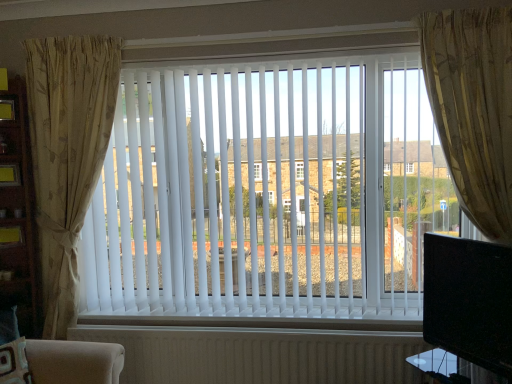
Question: Considering the relative sizes of white ribbed radiator at bottom and beige floral fabric curtain at left, which ranks as the 2th curtain in right-to-left order, in the image provided, is white ribbed radiator at bottom thinner than beige floral fabric curtain at left, which ranks as the 2th curtain in right-to-left order,?

Choices:
 (A) yes
 (B) no

Answer: (A)

Question: Can you confirm if white ribbed radiator at bottom is shorter than beige floral fabric curtain at left, which is the 1th curtain from left to right?

Choices:
 (A) no
 (B) yes

Answer: (B)

Question: From the image's perspective, is white ribbed radiator at bottom on top of beige floral fabric curtain at left, which ranks as the 2th curtain in right-to-left order?

Choices:
 (A) no
 (B) yes

Answer: (A)

Question: Is white ribbed radiator at bottom next to beige floral fabric curtain at left, which ranks as the 2th curtain in right-to-left order?

Choices:
 (A) no
 (B) yes

Answer: (A)

Question: Is the depth of white ribbed radiator at bottom greater than that of beige floral fabric curtain at left, which ranks as the 2th curtain in right-to-left order?

Choices:
 (A) yes
 (B) no

Answer: (A)

Question: Does white ribbed radiator at bottom have a greater width compared to beige floral fabric curtain at left, which ranks as the 2th curtain in right-to-left order?

Choices:
 (A) yes
 (B) no

Answer: (B)

Question: Is gold textured curtain at right, marked as the first curtain in a right-to-left arrangement, outside white ribbed radiator at bottom?

Choices:
 (A) yes
 (B) no

Answer: (A)

Question: Considering the relative sizes of gold textured curtain at right, marked as the first curtain in a right-to-left arrangement, and white ribbed radiator at bottom in the image provided, is gold textured curtain at right, marked as the first curtain in a right-to-left arrangement, taller than white ribbed radiator at bottom?

Choices:
 (A) yes
 (B) no

Answer: (A)

Question: Is gold textured curtain at right, marked as the first curtain in a right-to-left arrangement, shorter than white ribbed radiator at bottom?

Choices:
 (A) no
 (B) yes

Answer: (A)

Question: Is gold textured curtain at right, the 2th curtain viewed from the left, at the right side of white ribbed radiator at bottom?

Choices:
 (A) yes
 (B) no

Answer: (A)

Question: From the image's perspective, would you say gold textured curtain at right, the 2th curtain viewed from the left, is shown under white ribbed radiator at bottom?

Choices:
 (A) yes
 (B) no

Answer: (B)

Question: Is gold textured curtain at right, the 2th curtain viewed from the left, looking in the opposite direction of white ribbed radiator at bottom?

Choices:
 (A) no
 (B) yes

Answer: (A)

Question: From the image's perspective, would you say white ribbed radiator at bottom is positioned over black glossy tv at right?

Choices:
 (A) no
 (B) yes

Answer: (A)